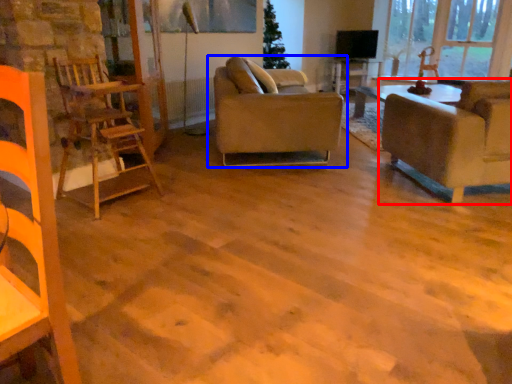
Question: Which of the following is the closest to the observer, studio couch (highlighted by a red box) or studio couch (highlighted by a blue box)?

Choices:
 (A) studio couch
 (B) studio couch

Answer: (A)